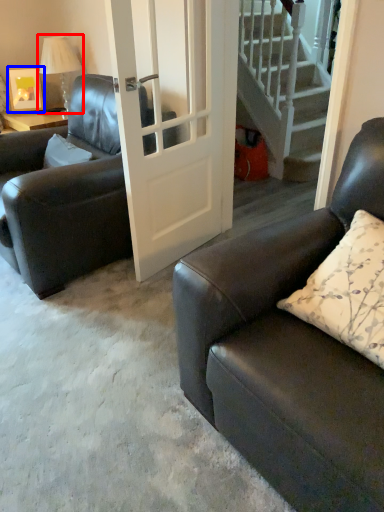
Question: Which object is further to the camera taking this photo, lamp (highlighted by a red box) or picture frame (highlighted by a blue box)?

Choices:
 (A) lamp
 (B) picture frame

Answer: (B)